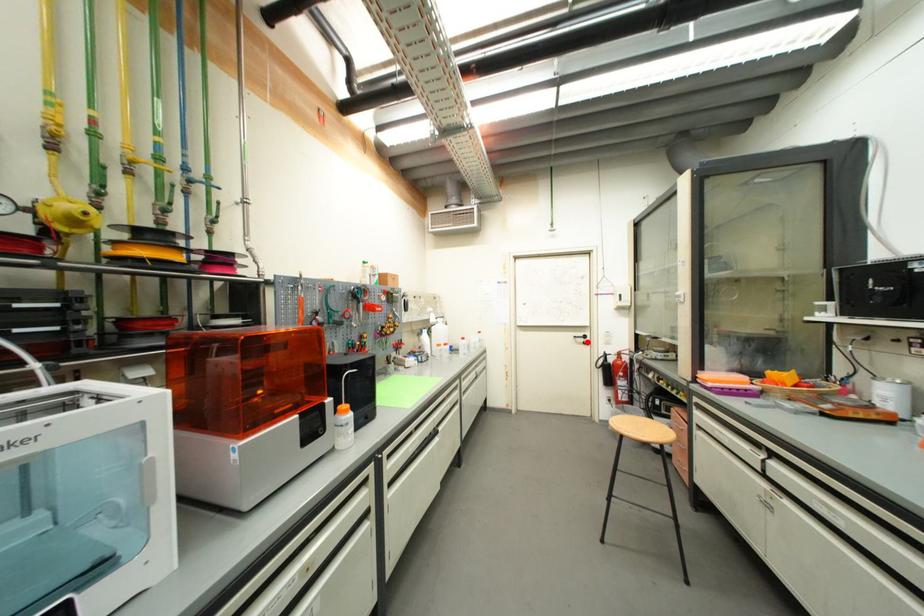
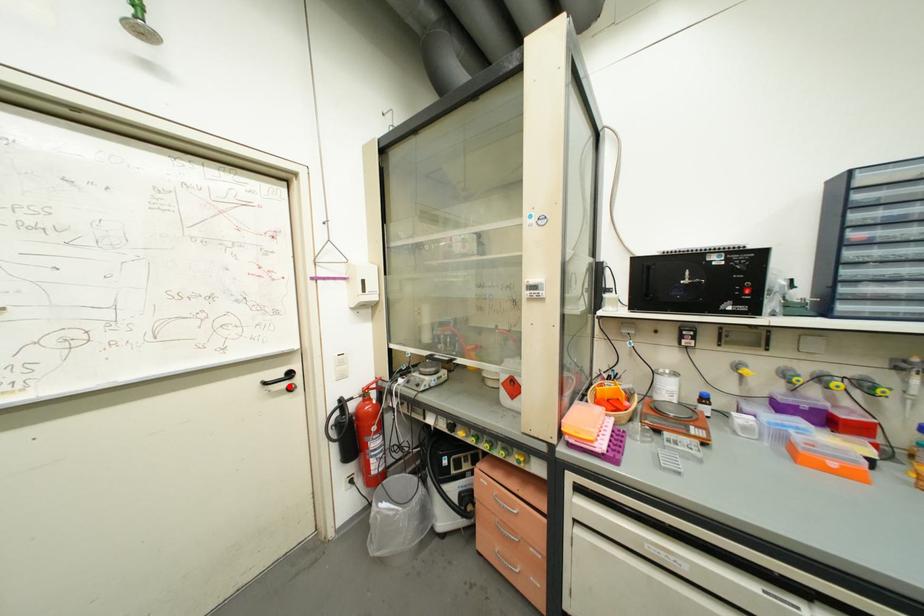
I am providing you with two images of the same scene from different viewpoints. A red point is marked on the first image and another point is marked on the second image. Is the marked point in image1 the same physical position as the marked point in image2?

Yes